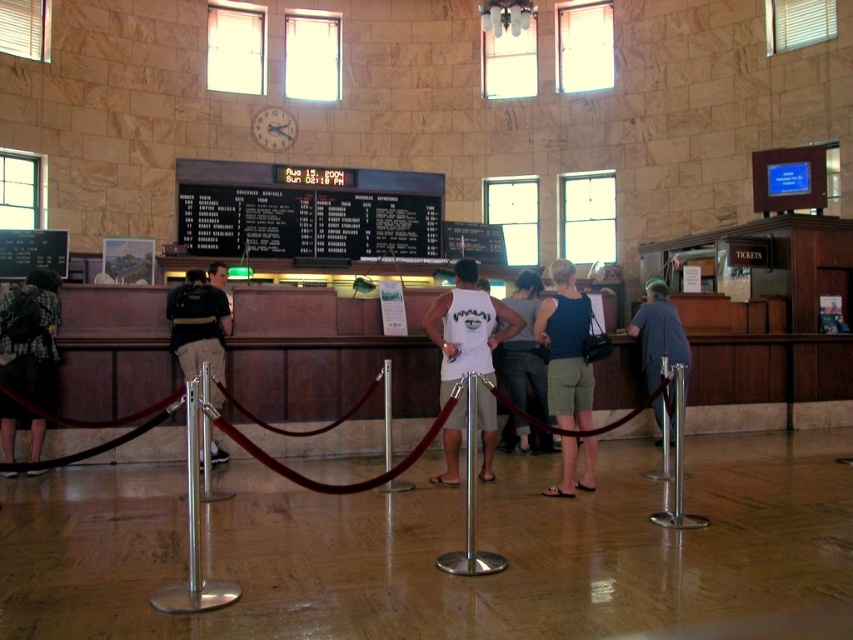
Who is positioned more to the left, plaid fabric shirt at left or white cotton tank top at center?

plaid fabric shirt at left is more to the left.

Is plaid fabric shirt at left to the left of white cotton tank top at center from the viewer's perspective?

Yes, plaid fabric shirt at left is to the left of white cotton tank top at center.

This screenshot has height=640, width=853. In order to click on plaid fabric shirt at left in this screenshot , I will do `click(30, 337)`.

Can you confirm if gray fabric shirt at center is wider than black fabric shirt at left?

Indeed, gray fabric shirt at center has a greater width compared to black fabric shirt at left.

Who is positioned more to the left, gray fabric shirt at center or black fabric shirt at left?

Positioned to the left is black fabric shirt at left.

At what (x,y) coordinates should I click in order to perform the action: click on gray fabric shirt at center. Please return your answer as a coordinate pair (x, y). Looking at the image, I should click on (659, 333).

Where is `black matte board at center`? black matte board at center is located at coordinates (305, 221).

Is black matte board at center thinner than white matte tank top at center?

In fact, black matte board at center might be wider than white matte tank top at center.

Which is in front, point (380, 220) or point (494, 314)?

Point (494, 314) is more forward.

You are a GUI agent. You are given a task and a screenshot of the screen. Output one action in this format:
    pyautogui.click(x=<x>, y=<y>)
    Task: Click on the black matte board at center
    The width and height of the screenshot is (853, 640).
    Given the screenshot: What is the action you would take?
    pyautogui.click(x=305, y=221)